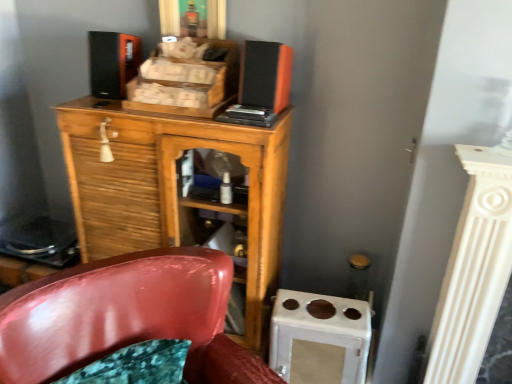
Identify the location of glossy plastic chair at lower left. (126, 317).

This screenshot has height=384, width=512. What do you see at coordinates (113, 63) in the screenshot? I see `matte black speaker at upper left, the 1th speaker in the left-to-right sequence` at bounding box center [113, 63].

The width and height of the screenshot is (512, 384). I want to click on matte black speaker at upper center, which is the 1th speaker in right-to-left order, so click(265, 75).

Is matte black speaker at upper center, which is the 1th speaker in right-to-left order, far from wooden cabinet at center?

They are positioned close to each other.

Is matte black speaker at upper center, positioned as the second speaker in left-to-right order, turned away from wooden cabinet at center?

No, matte black speaker at upper center, positioned as the second speaker in left-to-right order, is not facing away from wooden cabinet at center.

Considering the relative positions of matte black speaker at upper center, which is the 1th speaker in right-to-left order, and wooden cabinet at center in the image provided, is matte black speaker at upper center, which is the 1th speaker in right-to-left order, to the left of wooden cabinet at center from the viewer's perspective?

No.

Which is closer, (91, 113) or (211, 282)?

The point (211, 282) is in front.

Could you tell me if wooden cabinet at center is turned towards glossy plastic chair at lower left?

Yes, wooden cabinet at center is turned towards glossy plastic chair at lower left.

Considering their positions, is glossy plastic chair at lower left located in front of or behind matte black speaker at upper center, positioned as the second speaker in left-to-right order?

Visually, glossy plastic chair at lower left is located in front of matte black speaker at upper center, positioned as the second speaker in left-to-right order.

Is glossy plastic chair at lower left facing away from matte black speaker at upper center, positioned as the second speaker in left-to-right order?

glossy plastic chair at lower left does not have its back to matte black speaker at upper center, positioned as the second speaker in left-to-right order.

Which object is wider, glossy plastic chair at lower left or matte black speaker at upper center, positioned as the second speaker in left-to-right order?

With larger width is glossy plastic chair at lower left.

Image resolution: width=512 pixels, height=384 pixels. What are the coordinates of `chair on the left side of matte black speaker at upper center, which is the 1th speaker in right-to-left order` in the screenshot? It's located at (126, 317).

Considering the relative sizes of matte black speaker at upper left, the second speaker positioned from the right, and matte black speaker at upper center, which is the 1th speaker in right-to-left order, in the image provided, is matte black speaker at upper left, the second speaker positioned from the right, shorter than matte black speaker at upper center, which is the 1th speaker in right-to-left order,?

No, matte black speaker at upper left, the second speaker positioned from the right, is not shorter than matte black speaker at upper center, which is the 1th speaker in right-to-left order.

Considering the relative positions of matte black speaker at upper left, the second speaker positioned from the right, and matte black speaker at upper center, which is the 1th speaker in right-to-left order, in the image provided, is matte black speaker at upper left, the second speaker positioned from the right, to the left or to the right of matte black speaker at upper center, which is the 1th speaker in right-to-left order,?

From the image, it's evident that matte black speaker at upper left, the second speaker positioned from the right, is to the left of matte black speaker at upper center, which is the 1th speaker in right-to-left order.

From the image's perspective, which one is positioned higher, matte black speaker at upper left, the 1th speaker in the left-to-right sequence, or matte black speaker at upper center, which is the 1th speaker in right-to-left order?

matte black speaker at upper left, the 1th speaker in the left-to-right sequence, is shown above in the image.

Is matte black speaker at upper left, the second speaker positioned from the right, in front of or behind matte black speaker at upper center, positioned as the second speaker in left-to-right order, in the image?

matte black speaker at upper left, the second speaker positioned from the right, is behind matte black speaker at upper center, positioned as the second speaker in left-to-right order.

Where is `the chest of drawers behind the glossy plastic chair at lower left`? The width and height of the screenshot is (512, 384). the chest of drawers behind the glossy plastic chair at lower left is located at coordinates (173, 189).

Between glossy plastic chair at lower left and wooden cabinet at center, which one has larger width?

glossy plastic chair at lower left.

How distant is glossy plastic chair at lower left from wooden cabinet at center?

glossy plastic chair at lower left and wooden cabinet at center are 17.24 inches apart.

Could you tell me if glossy plastic chair at lower left is facing wooden cabinet at center?

No, glossy plastic chair at lower left is not turned towards wooden cabinet at center.

Does glossy plastic chair at lower left have a larger size compared to matte black speaker at upper left, the second speaker positioned from the right?

Indeed, glossy plastic chair at lower left has a larger size compared to matte black speaker at upper left, the second speaker positioned from the right.

Do you think glossy plastic chair at lower left is within matte black speaker at upper left, the second speaker positioned from the right, or outside of it?

glossy plastic chair at lower left lies outside matte black speaker at upper left, the second speaker positioned from the right.

Is there a large distance between glossy plastic chair at lower left and matte black speaker at upper left, the second speaker positioned from the right?

They are positioned close to each other.

Does glossy plastic chair at lower left come behind matte black speaker at upper left, the second speaker positioned from the right?

No, it is not.

Can you see matte black speaker at upper left, the 1th speaker in the left-to-right sequence, touching glossy plastic chair at lower left?

No, matte black speaker at upper left, the 1th speaker in the left-to-right sequence, is not touching glossy plastic chair at lower left.

From the image's perspective, is matte black speaker at upper left, the 1th speaker in the left-to-right sequence, located above glossy plastic chair at lower left?

Yes, from the image's perspective, matte black speaker at upper left, the 1th speaker in the left-to-right sequence, is on top of glossy plastic chair at lower left.

Is matte black speaker at upper left, the second speaker positioned from the right, surrounding glossy plastic chair at lower left?

No, glossy plastic chair at lower left is not a part of matte black speaker at upper left, the second speaker positioned from the right.

Identify the location of speaker on the left of glossy plastic chair at lower left. (113, 63).

The image size is (512, 384). I want to click on the 1st speaker above the wooden cabinet at center (from the image's perspective), so click(x=265, y=75).

I want to click on chair that is below the wooden cabinet at center (from the image's perspective), so click(126, 317).

Considering their positions, is glossy plastic chair at lower left positioned closer to matte black speaker at upper center, which is the 1th speaker in right-to-left order, than matte black speaker at upper left, the 1th speaker in the left-to-right sequence?

matte black speaker at upper left, the 1th speaker in the left-to-right sequence, lies closer to matte black speaker at upper center, which is the 1th speaker in right-to-left order, than the other object.

Which object lies nearer to the anchor point matte black speaker at upper left, the 1th speaker in the left-to-right sequence, glossy plastic chair at lower left or wooden cabinet at center?

Among the two, wooden cabinet at center is located nearer to matte black speaker at upper left, the 1th speaker in the left-to-right sequence.

Looking at the image, which one is located closer to matte black speaker at upper center, which is the 1th speaker in right-to-left order, wooden cabinet at center or matte black speaker at upper left, the second speaker positioned from the right?

wooden cabinet at center lies closer to matte black speaker at upper center, which is the 1th speaker in right-to-left order, than the other object.

Which object lies further to the anchor point wooden cabinet at center, glossy plastic chair at lower left or matte black speaker at upper center, which is the 1th speaker in right-to-left order?

glossy plastic chair at lower left lies further to wooden cabinet at center than the other object.

Looking at this image, looking at the image, which one is located further to wooden cabinet at center, matte black speaker at upper left, the second speaker positioned from the right, or glossy plastic chair at lower left?

glossy plastic chair at lower left is further to wooden cabinet at center.

From the image, which object appears to be farther from wooden cabinet at center, glossy plastic chair at lower left or matte black speaker at upper left, the second speaker positioned from the right?

glossy plastic chair at lower left is positioned further to the anchor wooden cabinet at center.

From the image, which object appears to be nearer to matte black speaker at upper center, which is the 1th speaker in right-to-left order, matte black speaker at upper left, the 1th speaker in the left-to-right sequence, or glossy plastic chair at lower left?

matte black speaker at upper left, the 1th speaker in the left-to-right sequence, is positioned closer to the anchor matte black speaker at upper center, which is the 1th speaker in right-to-left order.

Based on their spatial positions, is matte black speaker at upper center, which is the 1th speaker in right-to-left order, or matte black speaker at upper left, the second speaker positioned from the right, closer to wooden cabinet at center?

Based on the image, matte black speaker at upper left, the second speaker positioned from the right, appears to be nearer to wooden cabinet at center.

Find the location of a particular element. the chest of drawers between matte black speaker at upper center, which is the 1th speaker in right-to-left order, and glossy plastic chair at lower left vertically is located at coordinates (173, 189).

Identify the location of speaker between matte black speaker at upper left, the 1th speaker in the left-to-right sequence, and wooden cabinet at center vertically. (265, 75).

At what (x,y) coordinates should I click in order to perform the action: click on speaker between matte black speaker at upper left, the second speaker positioned from the right, and glossy plastic chair at lower left vertically. Please return your answer as a coordinate pair (x, y). Looking at the image, I should click on (265, 75).

Image resolution: width=512 pixels, height=384 pixels. Identify the location of chest of drawers between matte black speaker at upper left, the 1th speaker in the left-to-right sequence, and glossy plastic chair at lower left, in the vertical direction. (173, 189).